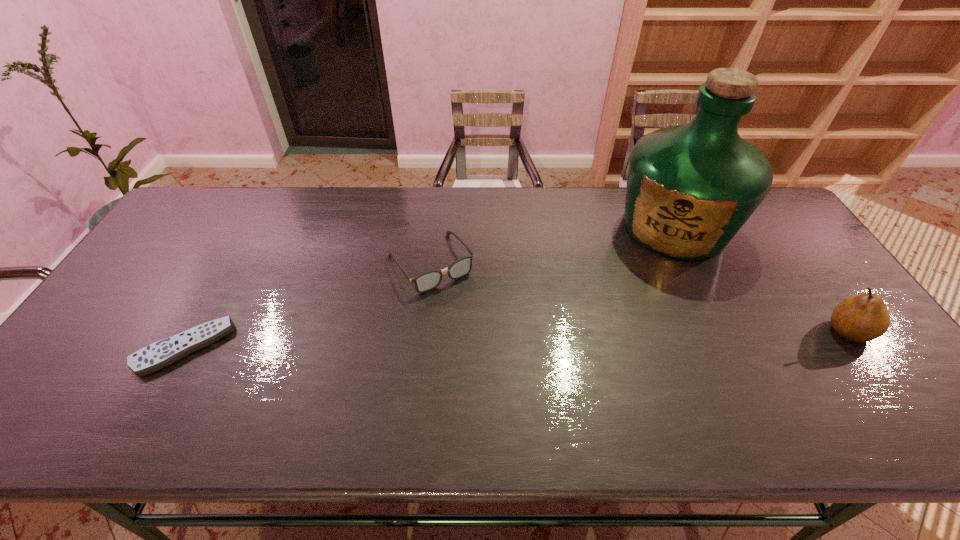
Where is `free spot on the desktop that is between the remote control and the second tallest object and is positioned on the face of the third object from right to left`? This screenshot has width=960, height=540. free spot on the desktop that is between the remote control and the second tallest object and is positioned on the face of the third object from right to left is located at coordinates tap(484, 340).

Where is `free space on the desktop that is between the leftmost object and the pear and is positioned on the label side of the second object from right to left`? Image resolution: width=960 pixels, height=540 pixels. free space on the desktop that is between the leftmost object and the pear and is positioned on the label side of the second object from right to left is located at coordinates (613, 337).